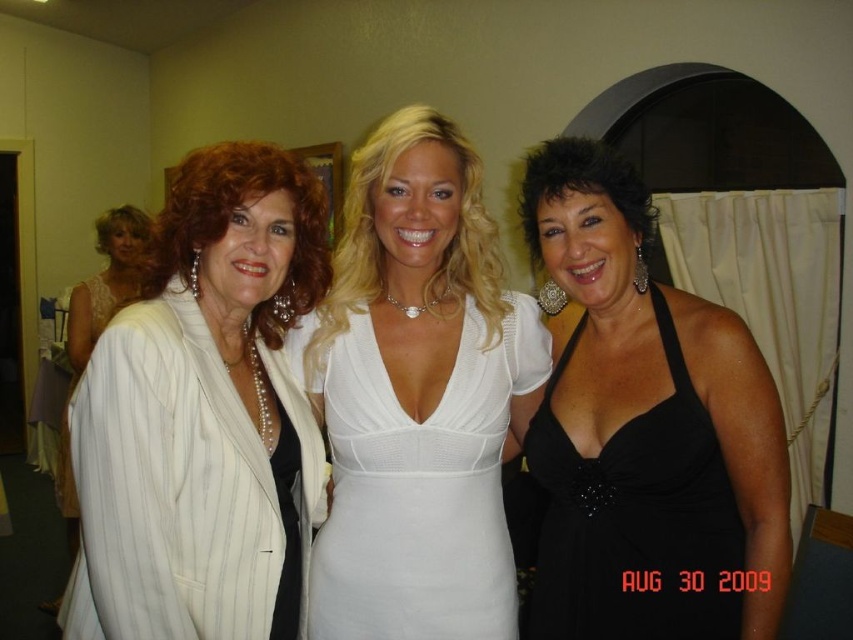
Question: Is white mesh dress at center positioned behind white satin dress at left?

Choices:
 (A) yes
 (B) no

Answer: (B)

Question: Is white pinstriped suit at left bigger than white striped suit at left?

Choices:
 (A) yes
 (B) no

Answer: (B)

Question: Which object appears closest to the camera in this image?

Choices:
 (A) white pinstriped suit at left
 (B) white satin dress at left
 (C) white mesh dress at center
 (D) black satin dress at center

Answer: (A)

Question: Which point is closer to the camera?

Choices:
 (A) (149, 417)
 (B) (126, 225)
 (C) (70, 465)
 (D) (590, 484)

Answer: (A)

Question: From the image, what is the correct spatial relationship of white mesh dress at center in relation to black satin dress at center?

Choices:
 (A) right
 (B) left

Answer: (B)

Question: Which object is the farthest from the black satin dress at center?

Choices:
 (A) white mesh dress at center
 (B) white satin dress at left
 (C) white striped suit at left

Answer: (B)